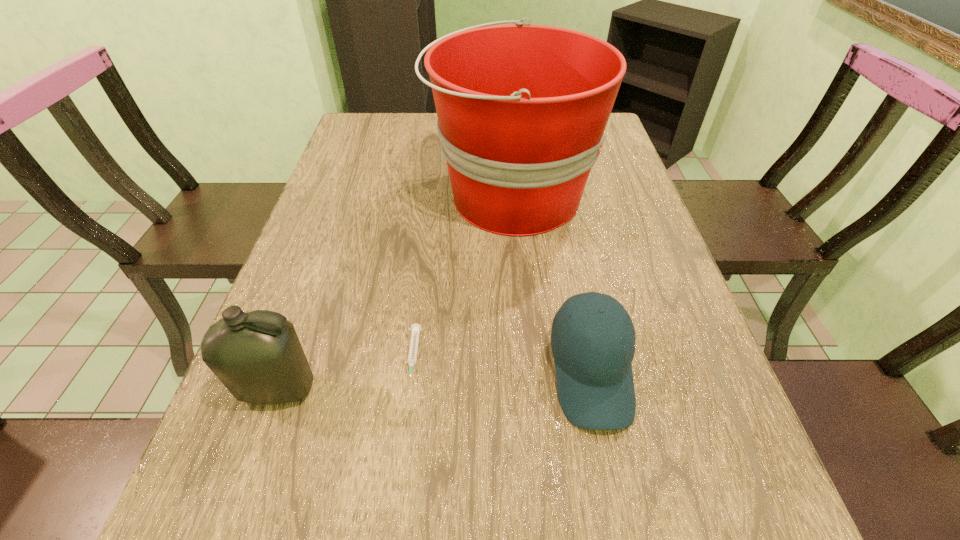
What are the coordinates of `the tallest object` in the screenshot? It's located at (522, 109).

Locate an element on the screen. This screenshot has height=540, width=960. the farthest object is located at coordinates (522, 109).

This screenshot has height=540, width=960. Find the location of `the second tallest object`. the second tallest object is located at coordinates (258, 357).

The width and height of the screenshot is (960, 540). I want to click on the leftmost object, so click(258, 357).

Where is `baseball cap`? The width and height of the screenshot is (960, 540). baseball cap is located at coordinates (594, 376).

Locate an element on the screen. syringe is located at coordinates (415, 330).

Where is `blank space located on the left of the tallest object`? This screenshot has height=540, width=960. blank space located on the left of the tallest object is located at coordinates (350, 197).

Image resolution: width=960 pixels, height=540 pixels. Identify the location of free space located on the right of the leftmost object. (442, 389).

Locate an element on the screen. The image size is (960, 540). vacant space located 0.120m on the front-facing side of the baseball cap is located at coordinates (620, 516).

Identify the location of free space located 0.150m at the needle end of the shortest object. (398, 474).